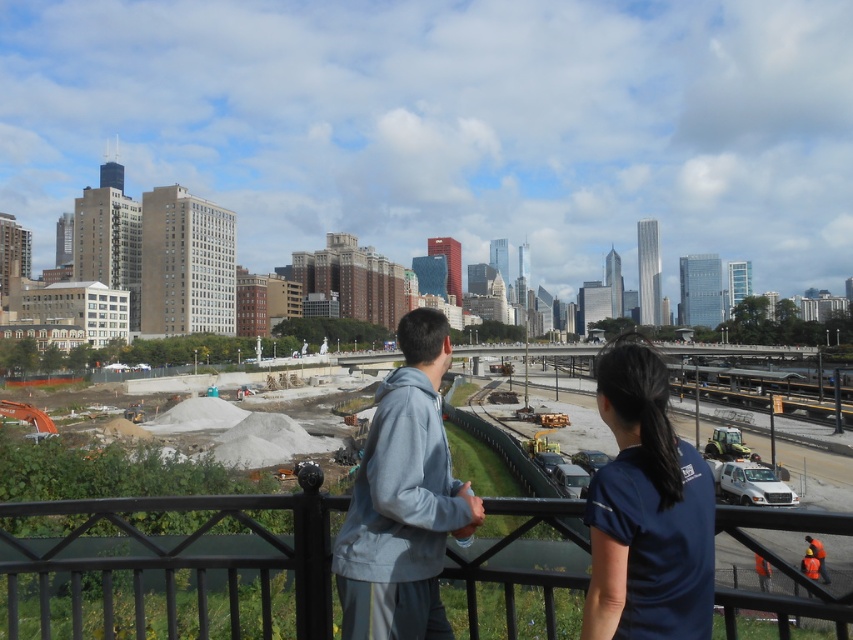
Is gray fleece jacket at center closer to the viewer compared to dark blue shirt at center?

No, gray fleece jacket at center is behind dark blue shirt at center.

Which is in front, point (607, 400) or point (670, 449)?

Positioned in front is point (670, 449).

The width and height of the screenshot is (853, 640). Find the location of `gray fleece jacket at center`. gray fleece jacket at center is located at coordinates (663, 483).

Which is in front, point (204, 518) or point (659, 465)?

Point (659, 465)

Between point (91, 516) and point (701, 554), which one is positioned behind?

The point (91, 516) is more distant.

Who is more forward, (x=766, y=550) or (x=640, y=394)?

Point (x=766, y=550) is more forward.

You are a GUI agent. You are given a task and a screenshot of the screen. Output one action in this format:
    pyautogui.click(x=<x>, y=<y>)
    Task: Click on the black metal railing at center
    The height and width of the screenshot is (640, 853).
    Given the screenshot: What is the action you would take?
    pyautogui.click(x=167, y=566)

Is dark blue shirt at center above light gray hoodie at center?

Yes.

How much distance is there between dark blue shirt at center and light gray hoodie at center?

The distance of dark blue shirt at center from light gray hoodie at center is 7.20 meters.

I want to click on dark blue shirt at center, so click(646, 512).